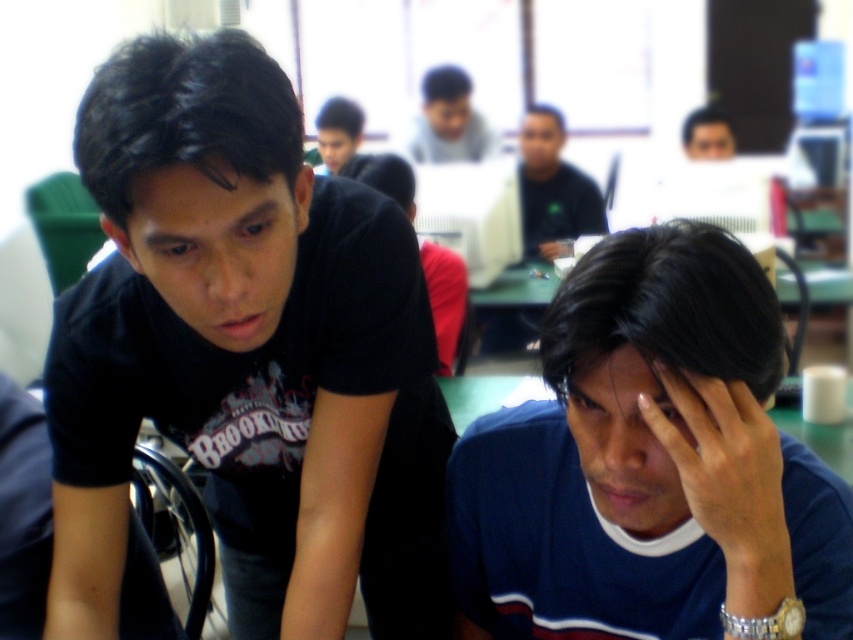
Question: Observing the image, what is the correct spatial positioning of dark skin/hair at lower center in reference to matte black shirt at center?

Choices:
 (A) right
 (B) left

Answer: (B)

Question: Which of the following is the closest to the observer?

Choices:
 (A) (532, 125)
 (B) (733, 532)

Answer: (B)

Question: Does black matte shirt at upper left have a smaller size compared to dark blue sweater at lower right?

Choices:
 (A) no
 (B) yes

Answer: (A)

Question: Which object is farther from the camera taking this photo?

Choices:
 (A) dark blue sweater at lower right
 (B) dark hair at upper center

Answer: (B)

Question: Which of the following is the farthest from the observer?

Choices:
 (A) (228, 113)
 (B) (445, 93)
 (C) (724, 134)

Answer: (B)

Question: Is black matte shirt at left bigger than dark blue sweater at lower right?

Choices:
 (A) no
 (B) yes

Answer: (B)